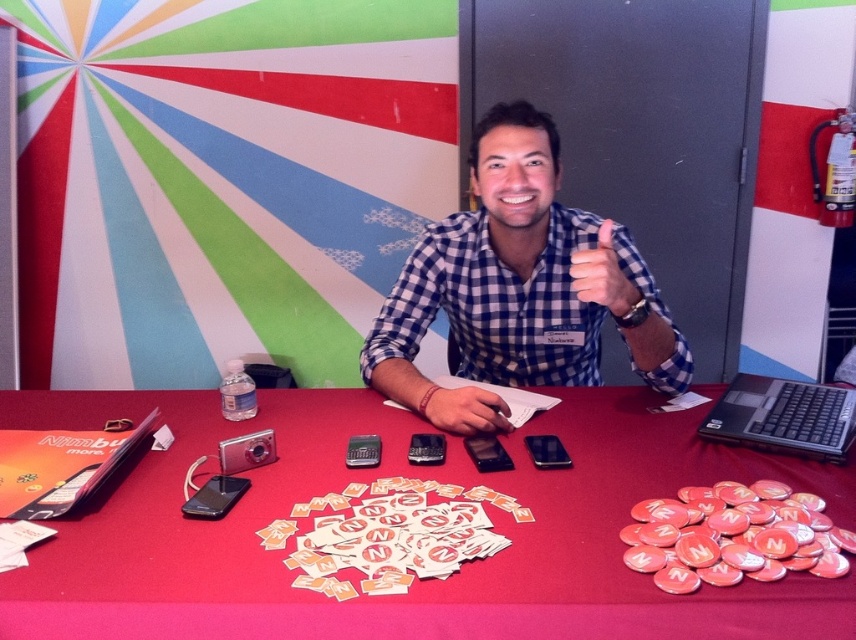
Question: Which point appears closest to the camera in this image?

Choices:
 (A) (599, 236)
 (B) (272, 557)

Answer: (B)

Question: Is red matte table at center positioned in front of matte blue checkered shirt at upper center?

Choices:
 (A) yes
 (B) no

Answer: (A)

Question: Is blue checkered shirt at center below white paper at center?

Choices:
 (A) yes
 (B) no

Answer: (B)

Question: Which object is the closest to the matte black mouse at center?

Choices:
 (A) blue checkered shirt at center
 (B) white paper at center
 (C) red matte table at center

Answer: (C)

Question: Which point is closer to the camera?

Choices:
 (A) (317, 525)
 (B) (581, 275)

Answer: (A)

Question: Does black plastic laptop at right come behind matte black mouse at center?

Choices:
 (A) yes
 (B) no

Answer: (B)